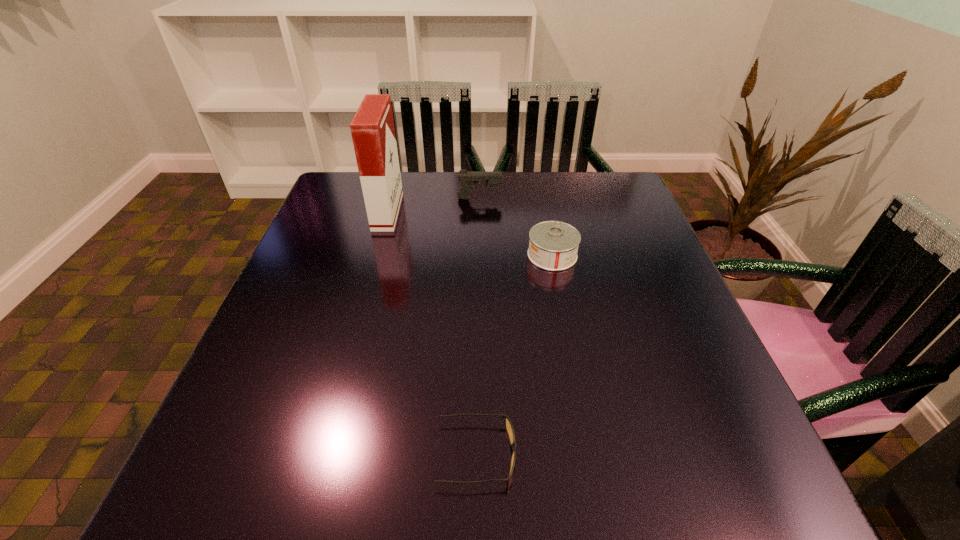
Where is `vacant region located on the front-facing side of the shortest object`? vacant region located on the front-facing side of the shortest object is located at coordinates (575, 454).

Where is `cigarette_case present at the far edge`? Image resolution: width=960 pixels, height=540 pixels. cigarette_case present at the far edge is located at coordinates (372, 128).

Image resolution: width=960 pixels, height=540 pixels. What are the coordinates of `pistol located in the far edge section of the desktop` in the screenshot? It's located at (469, 179).

Where is `object located in the near edge section of the desktop`? This screenshot has width=960, height=540. object located in the near edge section of the desktop is located at coordinates (509, 428).

I want to click on object that is at the left edge, so click(x=372, y=128).

This screenshot has height=540, width=960. I want to click on object located in the far left corner section of the desktop, so click(372, 128).

Locate an element on the screen. The image size is (960, 540). vacant space at the far edge is located at coordinates (509, 195).

Locate an element on the screen. The height and width of the screenshot is (540, 960). vacant space at the near edge is located at coordinates (623, 467).

At what (x,y) coordinates should I click in order to perform the action: click on free space at the left edge of the desktop. Please return your answer as a coordinate pair (x, y). The width and height of the screenshot is (960, 540). Looking at the image, I should click on (285, 332).

Locate an element on the screen. free spot at the right edge of the desktop is located at coordinates (628, 274).